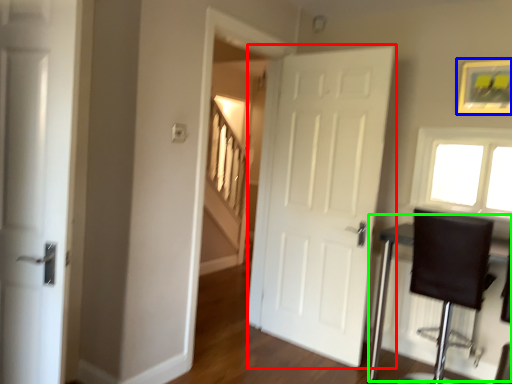
Question: Which is nearer to the door (highlighted by a red box)? picture frame (highlighted by a blue box) or table (highlighted by a green box).

Choices:
 (A) picture frame
 (B) table

Answer: (B)